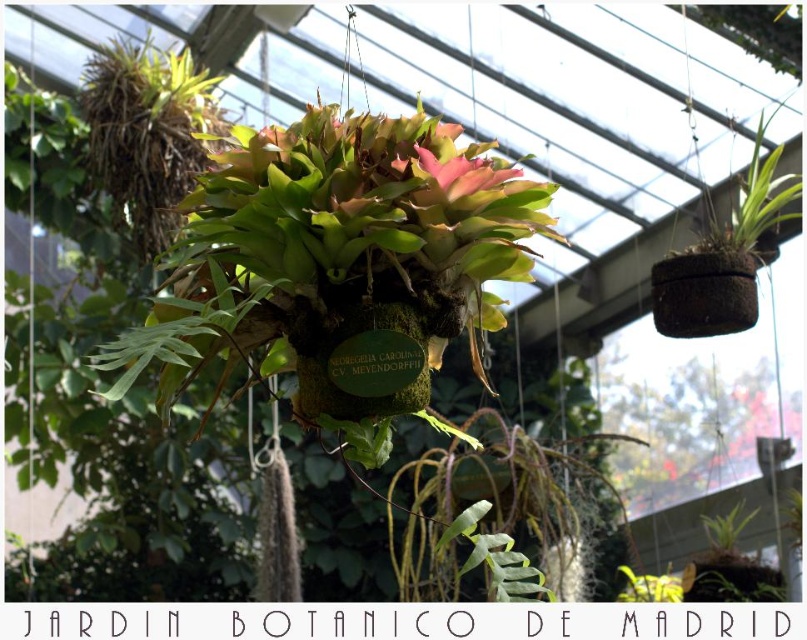
Question: Does green mossy hanging basket at center come in front of pink matte flower at center?

Choices:
 (A) no
 (B) yes

Answer: (B)

Question: Is green mossy hanging basket at center to the left of pink matte flower at center from the viewer's perspective?

Choices:
 (A) yes
 (B) no

Answer: (A)

Question: Can you confirm if green mossy hanging basket at center is bigger than pink matte flower at center?

Choices:
 (A) yes
 (B) no

Answer: (A)

Question: Which of the following is the closest to the observer?

Choices:
 (A) pink matte flower at center
 (B) green mossy hanging basket at center

Answer: (B)